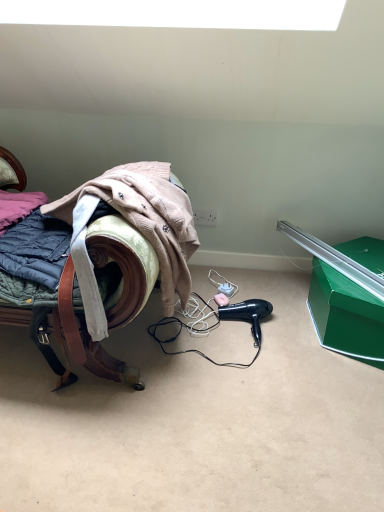
Where is `vacant area that is in front of green cardboard box at lower right`? The image size is (384, 512). vacant area that is in front of green cardboard box at lower right is located at coordinates click(x=331, y=404).